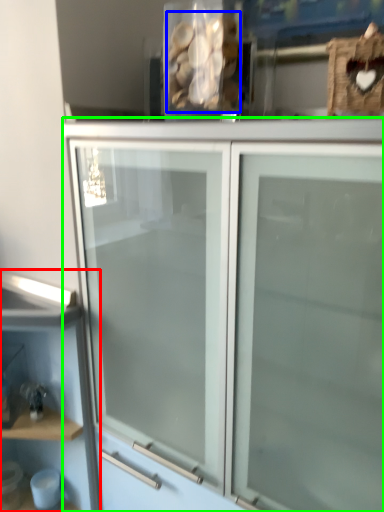
Question: Which is nearer to the shelf (highlighted by a red box)? stuff (highlighted by a blue box) or cupboard (highlighted by a green box).

Choices:
 (A) stuff
 (B) cupboard

Answer: (B)